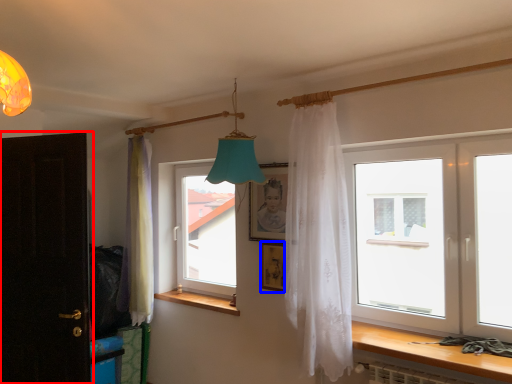
Question: Which object appears farthest to the camera in this image, door (highlighted by a red box) or picture frame (highlighted by a blue box)?

Choices:
 (A) door
 (B) picture frame

Answer: (B)